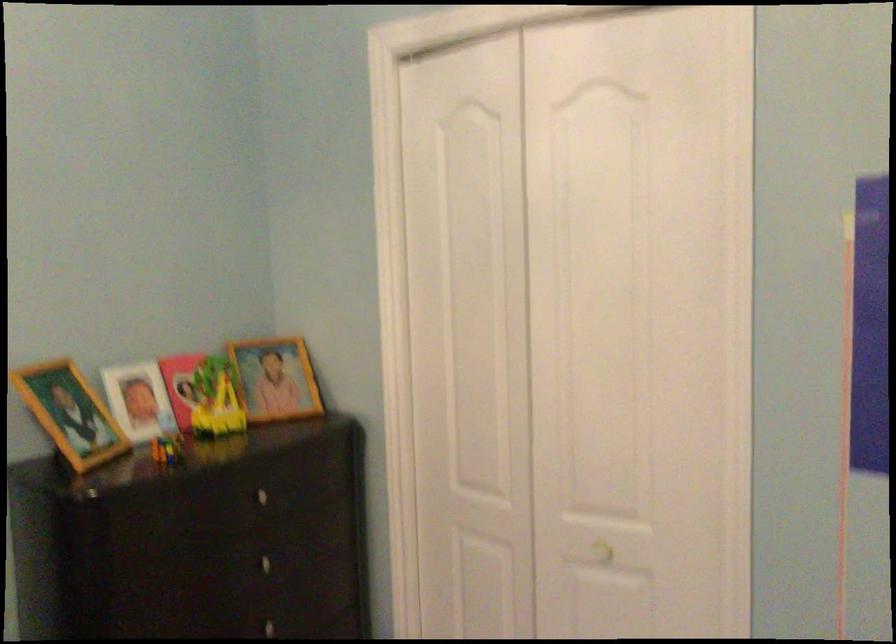
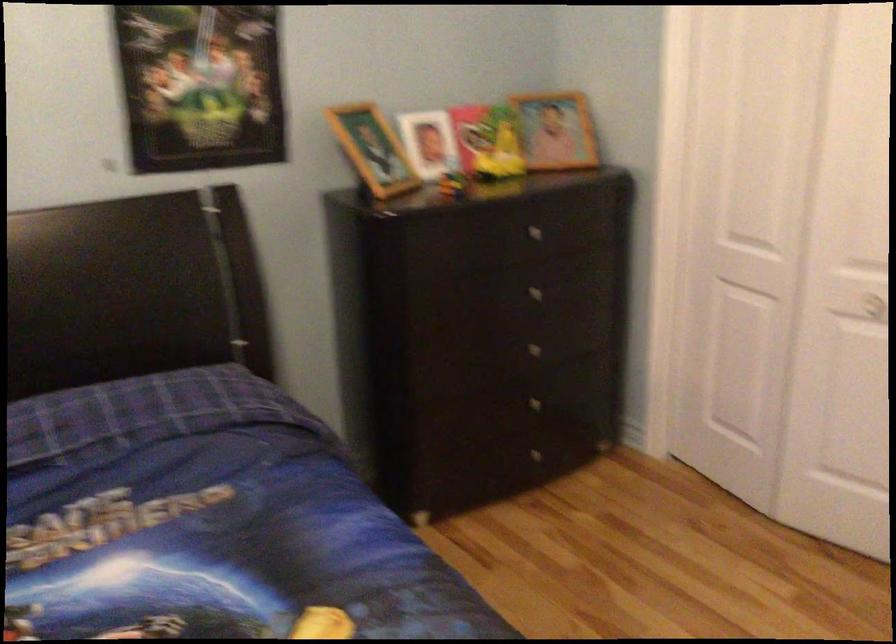
Locate, in the second image, the point that corresponds to (71,415) in the first image.

(373, 149)